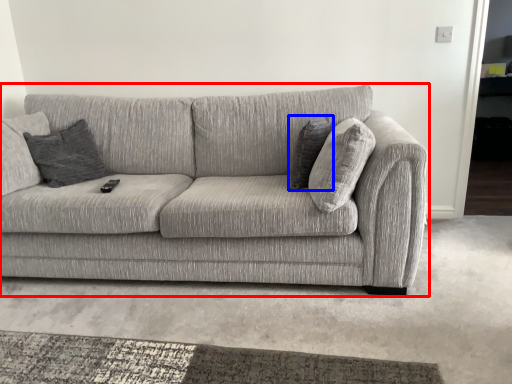
Question: Which object appears farthest to the camera in this image, studio couch (highlighted by a red box) or pillow (highlighted by a blue box)?

Choices:
 (A) studio couch
 (B) pillow

Answer: (B)